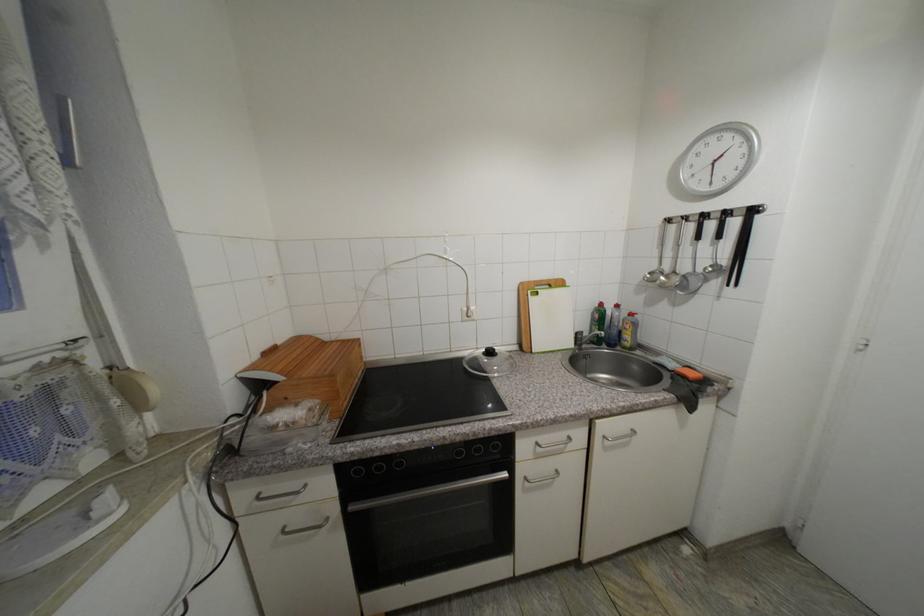
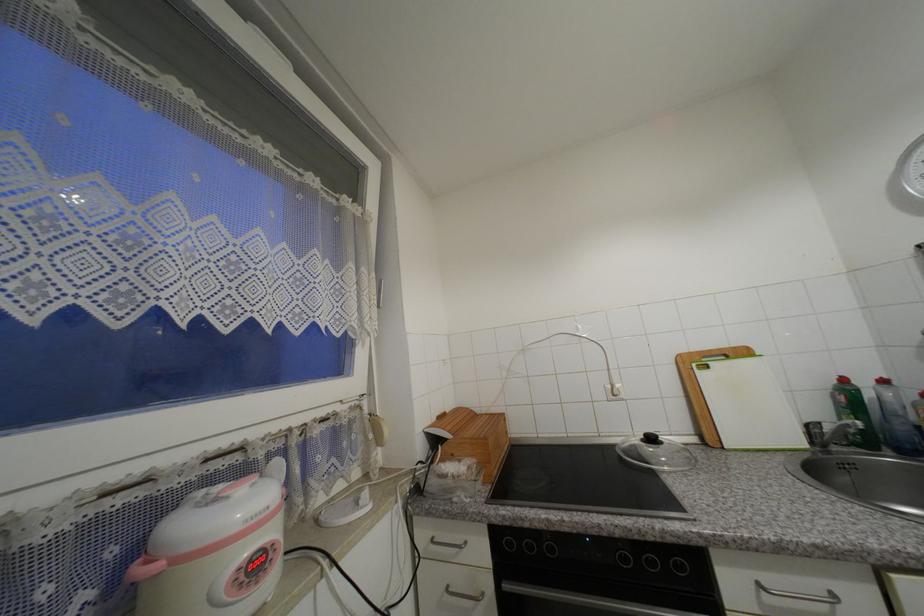
First-person continuous shooting, in which direction is the camera rotating?

The camera's rotation is toward left-up.